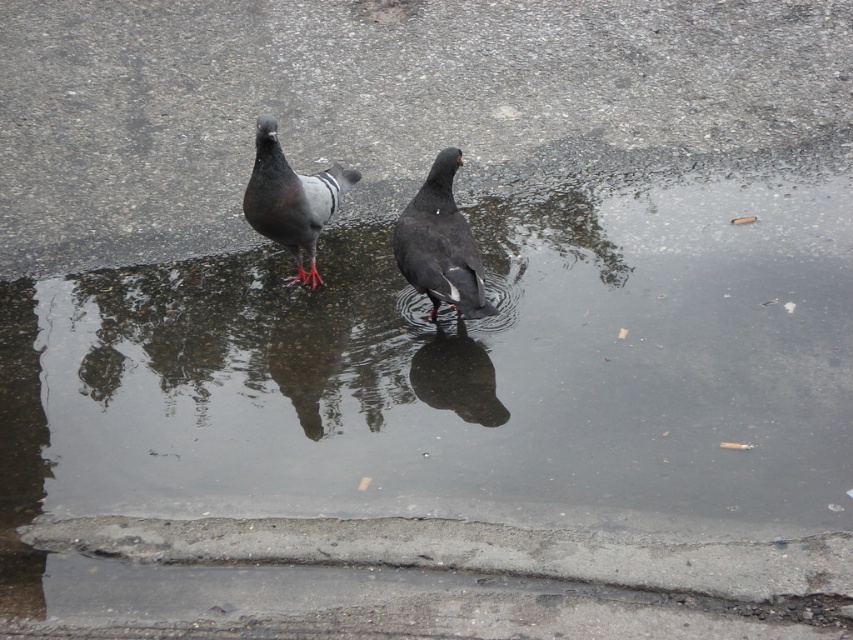
Describe the element at coordinates (291, 198) in the screenshot. Image resolution: width=853 pixels, height=640 pixels. I see `gray matte pigeon at center` at that location.

Is point (263, 186) closer to viewer compared to point (437, 340)?

Yes, it is.

Locate an element on the screen. gray matte pigeon at center is located at coordinates tap(291, 198).

Who is positioned more to the left, matte black pigeon at center or gray matte pigeon at center?

gray matte pigeon at center is more to the left.

Can you confirm if matte black pigeon at center is shorter than gray matte pigeon at center?

Incorrect, matte black pigeon at center's height does not fall short of gray matte pigeon at center's.

Measure the distance between point (x=451, y=148) and camera.

Point (x=451, y=148) is 16.62 feet from camera.

I want to click on matte black pigeon at center, so click(440, 244).

Is matte black pigeon at center below shiny black bird at center?

Actually, matte black pigeon at center is above shiny black bird at center.

Looking at this image, can you confirm if matte black pigeon at center is positioned to the left of shiny black bird at center?

Correct, you'll find matte black pigeon at center to the left of shiny black bird at center.

Is point (457, 284) behind point (502, 403)?

Yes, point (457, 284) is behind point (502, 403).

Find the location of a particular element. Image resolution: width=853 pixels, height=640 pixels. matte black pigeon at center is located at coordinates (440, 244).